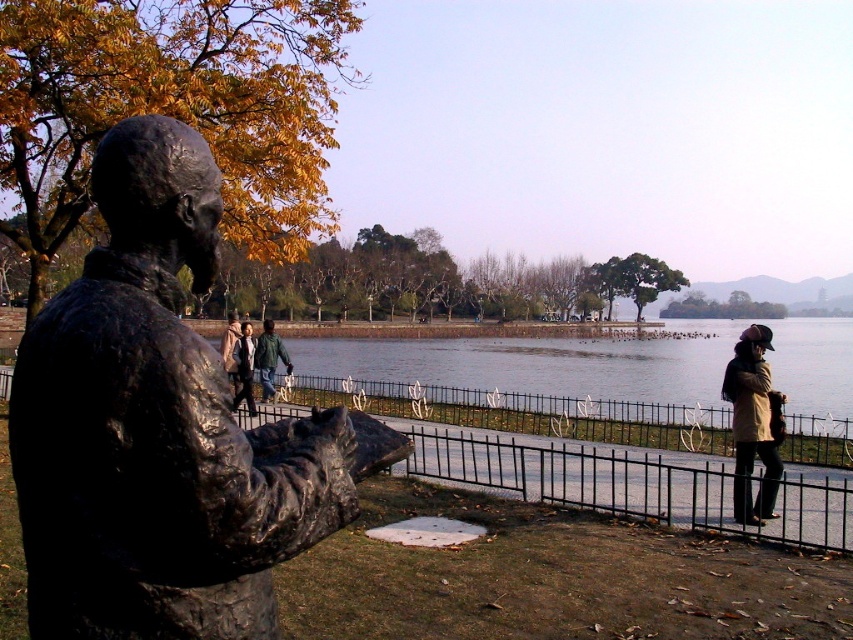
You are standing in the outdoor scene and want to determine which of the two points, point (340,436) or point (252,413), is nearer to you. Based on the image, which point is closer?

Point (340,436) is closer to the viewer than point (252,413).

You are standing at the center of the image. Which direction should you move to reach the bronze statue at left?

Since the bronze statue at left is located at point (x=161, y=428), you should move to the left to reach it.

You are standing in the park and see the bronze statue at left and the matte black jacket at center. Which object is higher in elevation?

The bronze statue at left is higher in elevation than the matte black jacket at center because it is positioned above it in the scene.